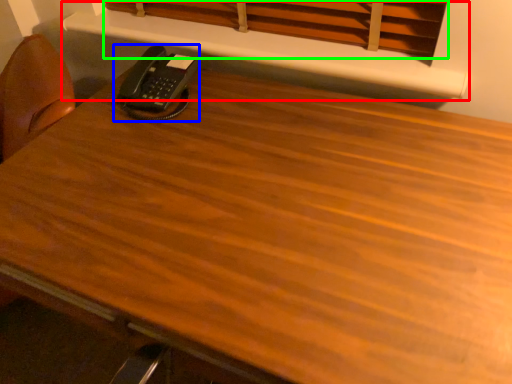
Question: Which object is positioned farthest from shelf (highlighted by a red box)? Select from corded phone (highlighted by a blue box) and curtain (highlighted by a green box).

Choices:
 (A) corded phone
 (B) curtain

Answer: (A)